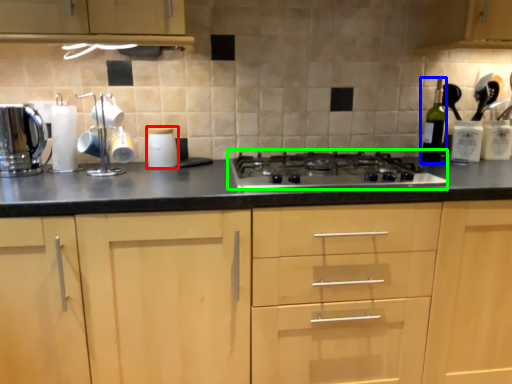
Question: Which object is positioned closest to kitchen appliance (highlighted by a red box)? Select from bottle (highlighted by a blue box) and gas stove (highlighted by a green box).

Choices:
 (A) bottle
 (B) gas stove

Answer: (B)